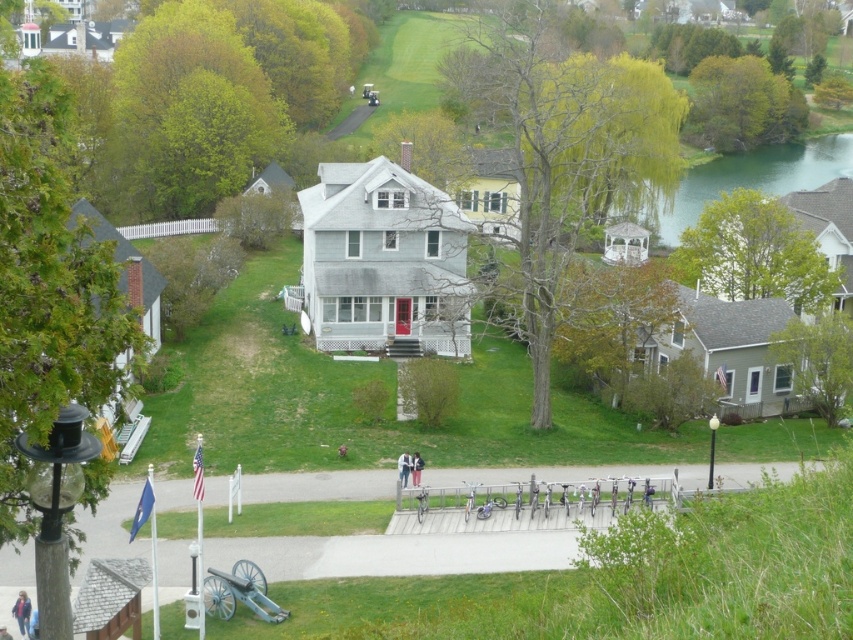
Who is taller, green water at upper right or gray metallic cannon at lower center?

green water at upper right is taller.

How far apart are green water at upper right and gray metallic cannon at lower center?

They are 275.28 feet apart.

This screenshot has height=640, width=853. Describe the element at coordinates (753, 177) in the screenshot. I see `green water at upper right` at that location.

The height and width of the screenshot is (640, 853). What are the coordinates of `green water at upper right` in the screenshot? It's located at (753, 177).